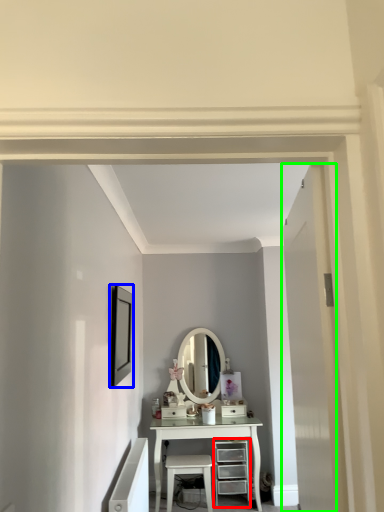
Question: Estimate the real-world distances between objects in this image. Which object is closer to chest of drawers (highlighted by a red box), picture frame (highlighted by a blue box) or door (highlighted by a green box)?

Choices:
 (A) picture frame
 (B) door

Answer: (A)